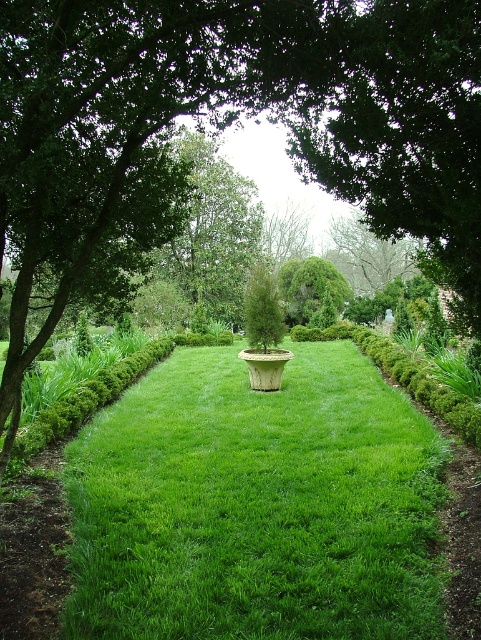
What do you see at coordinates (214, 230) in the screenshot? I see `green leafy tree at center` at bounding box center [214, 230].

Can you confirm if green leafy tree at center is positioned above green textured bush at center?

Indeed, green leafy tree at center is positioned over green textured bush at center.

The height and width of the screenshot is (640, 481). I want to click on green leafy tree at center, so (x=214, y=230).

You are a GUI agent. You are given a task and a screenshot of the screen. Output one action in this format:
    pyautogui.click(x=<x>, y=<y>)
    Task: Click on the green leafy tree at center
    This screenshot has height=640, width=481.
    Given the screenshot: What is the action you would take?
    pyautogui.click(x=214, y=230)

Can you confirm if green grass at center is positioned to the right of smooth bark tree at upper center?

Incorrect, green grass at center is not on the right side of smooth bark tree at upper center.

Measure the distance from green grass at center to smooth bark tree at upper center.

green grass at center and smooth bark tree at upper center are 24.21 meters apart.

Who is more distant from viewer, (243, 448) or (378, 240)?

The point (378, 240) is more distant.

Find the location of a particular element. The height and width of the screenshot is (640, 481). green grass at center is located at coordinates (255, 506).

Does smooth bark tree at upper center have a smaller size compared to green textured bush at center?

Yes.

Does smooth bark tree at upper center have a greater width compared to green textured bush at center?

No, smooth bark tree at upper center is not wider than green textured bush at center.

Between point (379, 272) and point (276, 308), which one is positioned in front?

Point (276, 308) is more forward.

Locate an element on the screen. smooth bark tree at upper center is located at coordinates (367, 253).